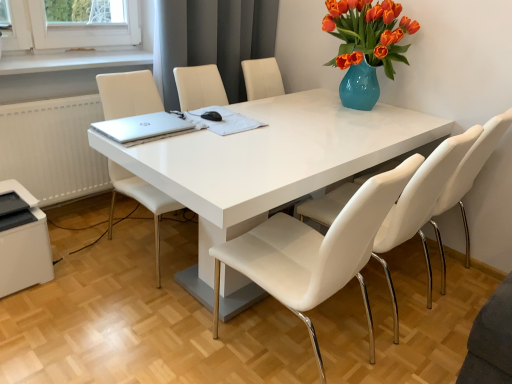
Describe the element at coordinates (213, 40) in the screenshot. The height and width of the screenshot is (384, 512). I see `gray fabric curtain at upper center` at that location.

The width and height of the screenshot is (512, 384). Describe the element at coordinates (23, 244) in the screenshot. I see `white plastic printer at lower left` at that location.

This screenshot has width=512, height=384. What do you see at coordinates (128, 94) in the screenshot?
I see `white leather chair at center, which is the 1th chair in left-to-right order` at bounding box center [128, 94].

In the scene shown: What is the approximate width of white leather chair at right, the 3th chair in the left-to-right sequence?

white leather chair at right, the 3th chair in the left-to-right sequence, is 24.45 inches wide.

Describe the element at coordinates (471, 170) in the screenshot. Image resolution: width=512 pixels, height=384 pixels. I see `white leather chair at right, the 3th chair in the left-to-right sequence` at that location.

Describe the element at coordinates (141, 126) in the screenshot. I see `silver metallic laptop at center` at that location.

The width and height of the screenshot is (512, 384). Identify the location of gray fabric curtain at upper center. (213, 40).

Find the location of a particular element. This screenshot has width=512, height=384. table located above the white plastic printer at lower left (from a real-world perspective) is located at coordinates (270, 159).

Which is correct: white glossy table at center is inside white plastic printer at lower left, or outside of it?

white glossy table at center cannot be found inside white plastic printer at lower left.

Consider the image. From a real-world perspective, is white glossy table at center over white plastic printer at lower left?

Correct, in the physical world, white glossy table at center is higher than white plastic printer at lower left.

Is point (384, 133) farther from viewer compared to point (53, 272)?

That is False.

Measure the distance from white leather chair at right, the 3th chair in the left-to-right sequence, to white leather chair at center, which is the 2th chair from right to left.

They are 18.94 inches apart.

From a real-world perspective, between white leather chair at right, which is the first chair from right to left, and white leather chair at center, which is the 2th chair from right to left, who is vertically higher?

Answer: white leather chair at right, which is the first chair from right to left.

Is white leather chair at right, which is the first chair from right to left, outside of white leather chair at center, which is the 2th chair from right to left?

That's correct, white leather chair at right, which is the first chair from right to left, is outside of white leather chair at center, which is the 2th chair from right to left.

Relative to white leather chair at center, which is the 2th chair from right to left, is white leather chair at right, which is the first chair from right to left, in front or behind?

white leather chair at right, which is the first chair from right to left, is positioned farther from the viewer than white leather chair at center, which is the 2th chair from right to left.

Can you see silver metallic laptop at center touching white leather chair at right, the 3th chair in the left-to-right sequence?

No, silver metallic laptop at center is not in contact with white leather chair at right, the 3th chair in the left-to-right sequence.

Which object is more forward, silver metallic laptop at center or white leather chair at right, the 3th chair in the left-to-right sequence?

silver metallic laptop at center is in front.

The height and width of the screenshot is (384, 512). I want to click on laptop that is in front of the white leather chair at right, the 3th chair in the left-to-right sequence, so click(141, 126).

What's the angular difference between silver metallic laptop at center and white leather chair at right, the 3th chair in the left-to-right sequence,'s facing directions?

The angle between the facing direction of silver metallic laptop at center and the facing direction of white leather chair at right, the 3th chair in the left-to-right sequence, is 91.7 degrees.

Can you tell me how much silver metallic laptop at center and white leather chair at center, acting as the third chair starting from the right, differ in facing direction?

They differ by 85.7 degrees in their facing directions.

Which is in front, point (147, 127) or point (122, 89)?

Positioned in front is point (147, 127).

Which object is thinner, silver metallic laptop at center or white leather chair at center, which is the 1th chair in left-to-right order?

silver metallic laptop at center.

How far apart are silver metallic laptop at center and white leather chair at center, which is the 1th chair in left-to-right order?

The distance of silver metallic laptop at center from white leather chair at center, which is the 1th chair in left-to-right order, is 10.13 inches.

Is white plastic printer at lower left bigger than silver metallic laptop at center?

Yes, white plastic printer at lower left is bigger than silver metallic laptop at center.

From the image's perspective, is white plastic printer at lower left on silver metallic laptop at center?

No, from the image's perspective, white plastic printer at lower left is not over silver metallic laptop at center.

Are white plastic printer at lower left and silver metallic laptop at center beside each other?

No, white plastic printer at lower left is not making contact with silver metallic laptop at center.

Is white plastic printer at lower left facing towards silver metallic laptop at center?

No.

Looking at this image, is gray fabric curtain at upper center at the back of white plastic printer at lower left?

No.

From a real-world perspective, which object rests below the other?

white plastic printer at lower left is physically lower.

Based on the photo, is white plastic printer at lower left bigger or smaller than gray fabric curtain at upper center?

In the image, white plastic printer at lower left appears to be smaller than gray fabric curtain at upper center.

From the picture: Are white plastic printer at lower left and gray fabric curtain at upper center far apart?

white plastic printer at lower left is far away from gray fabric curtain at upper center.

Where is `printer beneath the white leather chair at center, acting as the third chair starting from the right (from a real-world perspective)`? This screenshot has height=384, width=512. printer beneath the white leather chair at center, acting as the third chair starting from the right (from a real-world perspective) is located at coordinates (23, 244).

Is white plastic printer at lower left to the right of white leather chair at center, acting as the third chair starting from the right, from the viewer's perspective?

No.

From a real-world perspective, is white plastic printer at lower left positioned over white leather chair at center, acting as the third chair starting from the right, based on gravity?

No.

Consider the image. Does white plastic printer at lower left have a greater height compared to white leather chair at center, which is the 1th chair in left-to-right order?

In fact, white plastic printer at lower left may be shorter than white leather chair at center, which is the 1th chair in left-to-right order.

At what (x,y) coordinates should I click in order to perform the action: click on printer below the white glossy table at center (from the image's perspective). Please return your answer as a coordinate pair (x, y). Looking at the image, I should click on (23, 244).

Starting from the white leather chair at right, which is the first chair from right to left, which chair is the 2nd one in front? Please provide its 2D coordinates.

[(315, 252)]

Which object lies further to the anchor point white leather chair at center, which is the 1th chair in left-to-right order, white plastic printer at lower left or white leather chair at right, the 3th chair in the left-to-right sequence?

Among the two, white leather chair at right, the 3th chair in the left-to-right sequence, is located further to white leather chair at center, which is the 1th chair in left-to-right order.

Which object lies nearer to the anchor point white glossy table at center, white leather chair at center, which is the 1th chair in left-to-right order, or white leather chair at center, which ranks as the second chair in left-to-right order?

The object closer to white glossy table at center is white leather chair at center, which ranks as the second chair in left-to-right order.

Based on their spatial positions, is white leather chair at center, which ranks as the second chair in left-to-right order, or silver metallic laptop at center further from gray fabric curtain at upper center?

The object further to gray fabric curtain at upper center is white leather chair at center, which ranks as the second chair in left-to-right order.

Considering their positions, is white leather chair at right, the 3th chair in the left-to-right sequence, positioned further to white plastic printer at lower left than gray fabric curtain at upper center?

white leather chair at right, the 3th chair in the left-to-right sequence, lies further to white plastic printer at lower left than the other object.

When comparing their distances from white glossy table at center, does gray fabric curtain at upper center or white leather chair at right, which is the first chair from right to left, seem closer?

The object closer to white glossy table at center is white leather chair at right, which is the first chair from right to left.

Looking at the image, which one is located closer to gray fabric curtain at upper center, silver metallic laptop at center or white leather chair at center, which is the 1th chair in left-to-right order?

white leather chair at center, which is the 1th chair in left-to-right order, is positioned closer to the anchor gray fabric curtain at upper center.

Which object lies nearer to the anchor point white leather chair at right, the 3th chair in the left-to-right sequence, silver metallic laptop at center or white glossy table at center?

white glossy table at center is closer to white leather chair at right, the 3th chair in the left-to-right sequence.

Considering their positions, is white leather chair at right, which is the first chair from right to left, positioned closer to white leather chair at center, which is the 1th chair in left-to-right order, than white glossy table at center?

The object closer to white leather chair at center, which is the 1th chair in left-to-right order, is white glossy table at center.

Identify the location of chair between white plastic printer at lower left and white glossy table at center in the horizontal direction. The width and height of the screenshot is (512, 384). (128, 94).

In order to click on laptop situated between white plastic printer at lower left and white leather chair at right, the 3th chair in the left-to-right sequence, from left to right in this screenshot , I will do click(x=141, y=126).

What are the coordinates of `laptop between gray fabric curtain at upper center and white plastic printer at lower left in the vertical direction` in the screenshot? It's located at (141, 126).

Image resolution: width=512 pixels, height=384 pixels. In order to click on curtain situated between white plastic printer at lower left and white glossy table at center from left to right in this screenshot , I will do `click(213, 40)`.